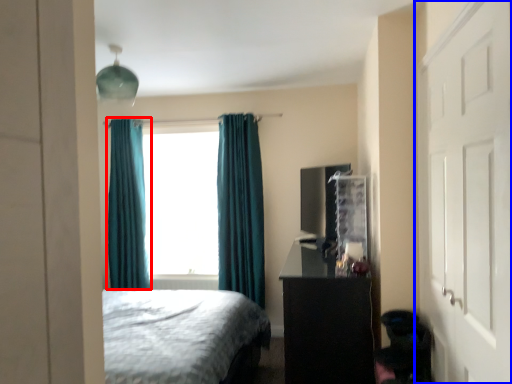
Question: Which object is further to the camera taking this photo, curtain (highlighted by a red box) or door (highlighted by a blue box)?

Choices:
 (A) curtain
 (B) door

Answer: (A)